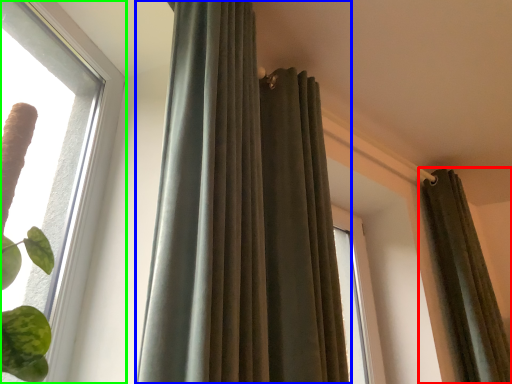
Question: Based on their relative distances, which object is farther from curtain (highlighted by a red box)? Choose from curtain (highlighted by a blue box) and window (highlighted by a green box).

Choices:
 (A) curtain
 (B) window

Answer: (B)